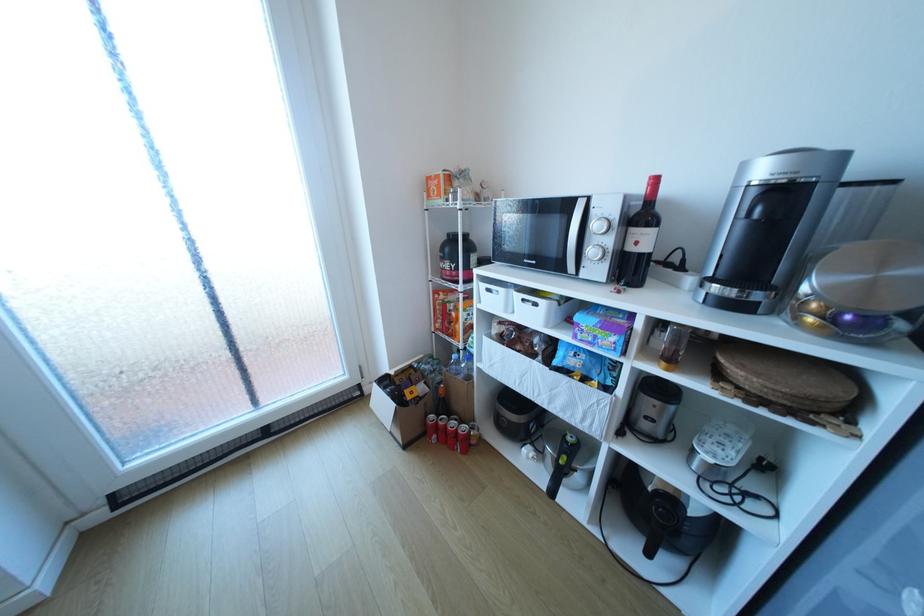
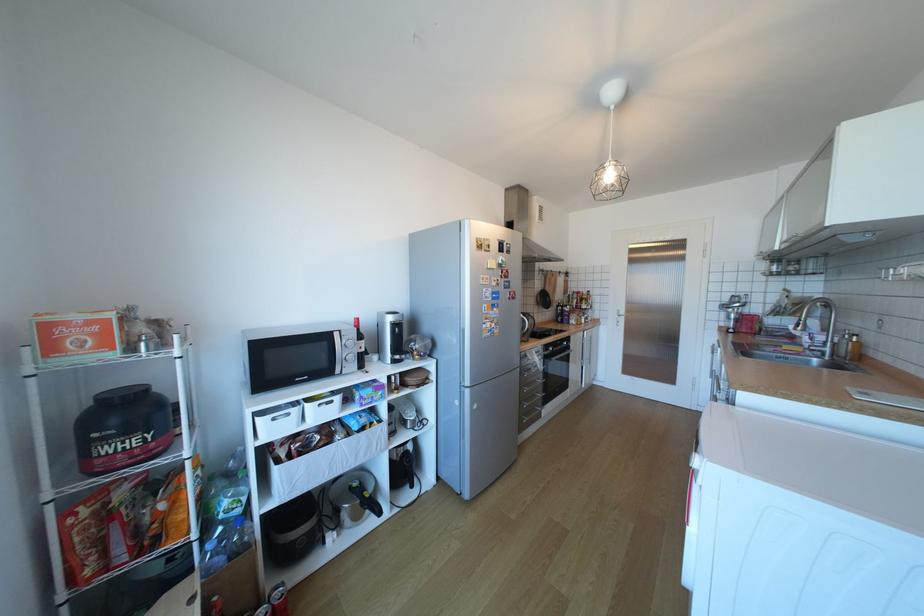
Where in the second image is the point corresponding to [497,290] from the first image?

(283, 419)